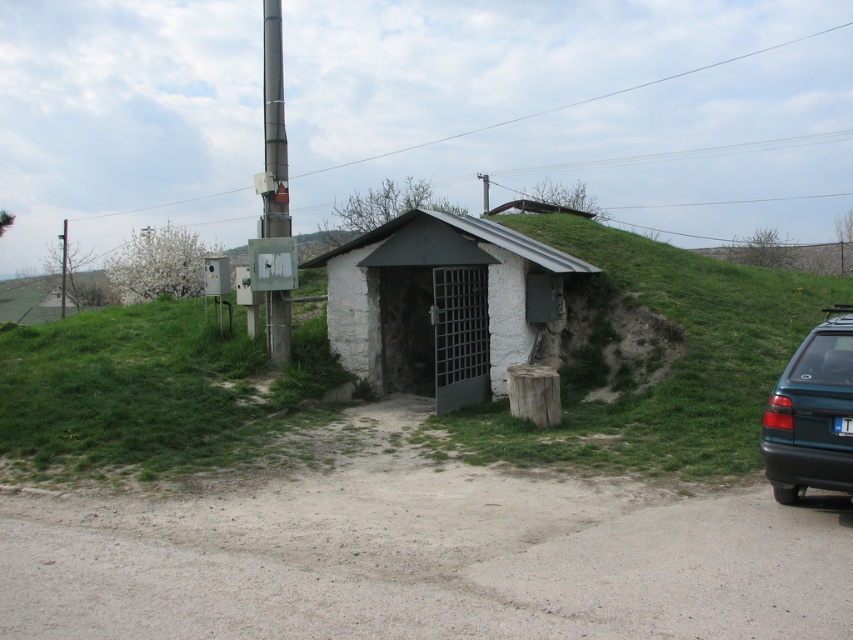
Does teal matte hatchback at right come behind white plastic license plate at right?

That is False.

Between point (838, 400) and point (844, 433), which one is positioned in front?

Point (844, 433)

You are a GUI agent. You are given a task and a screenshot of the screen. Output one action in this format:
    pyautogui.click(x=<x>, y=<y>)
    Task: Click on the teal matte hatchback at right
    This screenshot has height=640, width=853.
    Given the screenshot: What is the action you would take?
    pyautogui.click(x=811, y=412)

Between point (778, 452) and point (276, 129), which one is positioned behind?

Point (276, 129)

Between point (804, 372) and point (276, 308), which one is positioned in front?

Point (804, 372) is in front.

What are the coordinates of `teal matte hatchback at right` in the screenshot? It's located at (811, 412).

From the picture: Does green grassy at center have a smaller size compared to white stucco hut at center?

Incorrect, green grassy at center is not smaller in size than white stucco hut at center.

Can you confirm if green grassy at center is bigger than white stucco hut at center?

Yes.

Which is in front, point (630, 289) or point (451, 236)?

Point (451, 236)

Locate an element on the screen. The width and height of the screenshot is (853, 640). green grassy at center is located at coordinates (666, 362).